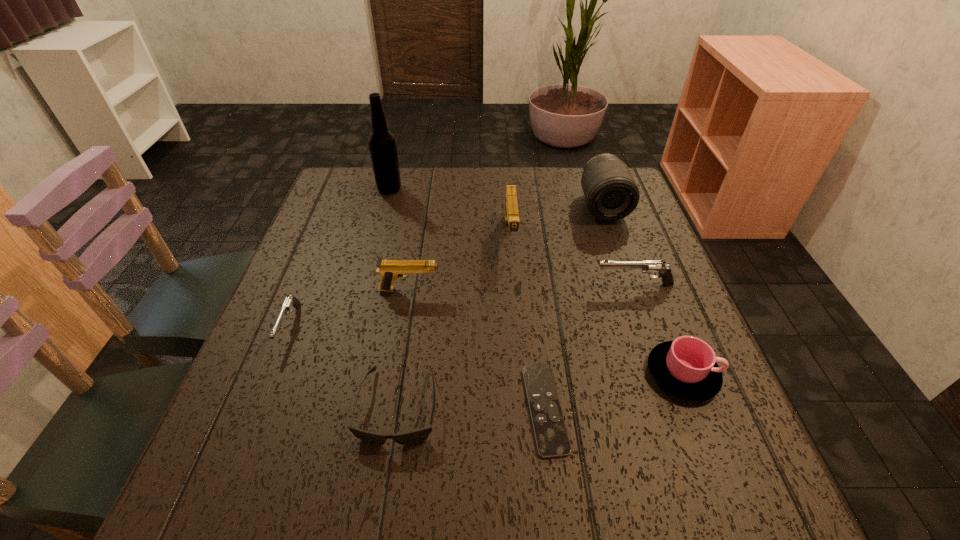
Locate an element on the screen. The image size is (960, 540). the eighth object from right to left is located at coordinates (382, 145).

Locate an element on the screen. Image resolution: width=960 pixels, height=540 pixels. beer bottle is located at coordinates (382, 145).

You are a GUI agent. You are given a task and a screenshot of the screen. Output one action in this format:
    pyautogui.click(x=<x>, y=<y>)
    Task: Click on the gray telephoto lens
    This screenshot has width=960, height=540.
    Given the screenshot: What is the action you would take?
    pyautogui.click(x=611, y=193)

Locate an element on the screen. the third pistol from left to right is located at coordinates (511, 206).

You are a GUI agent. You are given a task and a screenshot of the screen. Output one action in this format:
    pyautogui.click(x=<x>, y=<y>)
    Task: Click on the right tan pistol
    This screenshot has width=960, height=540.
    Given the screenshot: What is the action you would take?
    pyautogui.click(x=511, y=206)

Locate an element on the screen. This screenshot has height=540, width=960. the left tan pistol is located at coordinates (390, 270).

Locate an element on the screen. This screenshot has height=540, width=960. the nearer tan pistol is located at coordinates (390, 270).

Where is `the bigger silver pistol`? The height and width of the screenshot is (540, 960). the bigger silver pistol is located at coordinates (649, 267).

In order to click on the third tallest pistol in this screenshot , I will do `click(649, 267)`.

Where is `cup`? The width and height of the screenshot is (960, 540). cup is located at coordinates (686, 367).